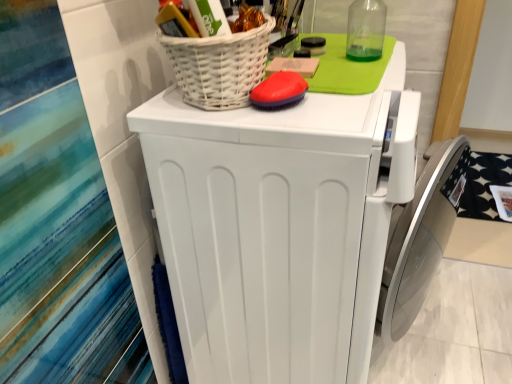
Identify the location of white wicker basket at upper center. (219, 66).

Locate an element on the screen. The image size is (512, 384). white wicker basket at upper center is located at coordinates point(219,66).

From the image's perspective, relative to red rubber brush at upper center, is white wicker basket at upper center above or below?

Based on their image positions, white wicker basket at upper center is located above red rubber brush at upper center.

Which object is positioned more to the left, white wicker basket at upper center or red rubber brush at upper center?

white wicker basket at upper center.

Between white wicker basket at upper center and red rubber brush at upper center, which one has larger width?

With larger width is white wicker basket at upper center.

Is white wicker basket at upper center not near red rubber brush at upper center?

That's not correct — white wicker basket at upper center is a little close to red rubber brush at upper center.

Would you say red rubber brush at upper center is outside white matte washing machine at center?

Yes, red rubber brush at upper center is outside of white matte washing machine at center.

Does point (296, 101) come in front of point (233, 290)?

Yes, it is in front of point (233, 290).

From a real-world perspective, relative to white matte washing machine at center, is red rubber brush at upper center vertically above or below?

red rubber brush at upper center is above white matte washing machine at center.

How many degrees apart are the facing directions of red rubber brush at upper center and white matte washing machine at center?

There is a 0.739-degree angle between the facing directions of red rubber brush at upper center and white matte washing machine at center.

Is the position of white matte washing machine at center less distant than that of white wicker basket at upper center?

Yes, it is in front of white wicker basket at upper center.

Considering the points (257, 186) and (201, 59), which point is in front, point (257, 186) or point (201, 59)?

The point (201, 59) is closer.

Measure the distance between white matte washing machine at center and white wicker basket at upper center.

They are 10.67 inches apart.

From the image's perspective, is white matte washing machine at center positioned above or below white wicker basket at upper center?

From the image's perspective, white matte washing machine at center appears below white wicker basket at upper center.

Locate an element on the screen. basket on the left of red rubber brush at upper center is located at coordinates (219, 66).

Which of these two, red rubber brush at upper center or white wicker basket at upper center, is bigger?

With larger size is white wicker basket at upper center.

From a real-world perspective, is red rubber brush at upper center positioned above or below white wicker basket at upper center?

Clearly, from a real-world perspective, red rubber brush at upper center is below white wicker basket at upper center.

From a real-world perspective, between white wicker basket at upper center and white matte washing machine at center, who is vertically higher?

In real-world perspective, white wicker basket at upper center is above.

Does white wicker basket at upper center have a smaller size compared to white matte washing machine at center?

Yes.

Between white wicker basket at upper center and white matte washing machine at center, which one is positioned in front?

white matte washing machine at center is more forward.

Which object is thinner, white wicker basket at upper center or white matte washing machine at center?

With smaller width is white wicker basket at upper center.

How many degrees apart are the facing directions of white matte washing machine at center and red rubber brush at upper center?

The facing directions of white matte washing machine at center and red rubber brush at upper center are 0.739 degrees apart.

Would you say white matte washing machine at center is outside red rubber brush at upper center?

white matte washing machine at center is positioned outside red rubber brush at upper center.

You are a GUI agent. You are given a task and a screenshot of the screen. Output one action in this format:
    pyautogui.click(x=<x>, y=<y>)
    Task: Click on the home appliance directly beneath the red rubber brush at upper center (from a real-world perspective)
    This screenshot has width=512, height=384.
    Given the screenshot: What is the action you would take?
    (x=279, y=227)

Which object is more forward, white matte washing machine at center or red rubber brush at upper center?

white matte washing machine at center is in front.

This screenshot has width=512, height=384. Find the location of `soap below the white wicker basket at upper center (from a real-world perspective)`. soap below the white wicker basket at upper center (from a real-world perspective) is located at coordinates (279, 91).

In the image, there is a red rubber brush at upper center. Where is `home appliance below it (from the image's perspective)`? The width and height of the screenshot is (512, 384). home appliance below it (from the image's perspective) is located at coordinates (279, 227).

Based on their spatial positions, is red rubber brush at upper center or white matte washing machine at center closer to white wicker basket at upper center?

red rubber brush at upper center lies closer to white wicker basket at upper center than the other object.

Looking at the image, which one is located closer to white matte washing machine at center, white wicker basket at upper center or red rubber brush at upper center?

white wicker basket at upper center is positioned closer to the anchor white matte washing machine at center.

Considering their positions, is red rubber brush at upper center positioned closer to white matte washing machine at center than white wicker basket at upper center?

Based on the image, white wicker basket at upper center appears to be nearer to white matte washing machine at center.

Based on the photo, estimate the real-world distances between objects in this image. Which object is further from red rubber brush at upper center, white matte washing machine at center or white wicker basket at upper center?

white matte washing machine at center lies further to red rubber brush at upper center than the other object.

Looking at the image, which one is located closer to white wicker basket at upper center, white matte washing machine at center or red rubber brush at upper center?

Based on the image, red rubber brush at upper center appears to be nearer to white wicker basket at upper center.

Looking at the image, which one is located further to red rubber brush at upper center, white wicker basket at upper center or white matte washing machine at center?

white matte washing machine at center lies further to red rubber brush at upper center than the other object.

Locate an element on the screen. Image resolution: width=512 pixels, height=384 pixels. soap between white wicker basket at upper center and white matte washing machine at center vertically is located at coordinates (279, 91).